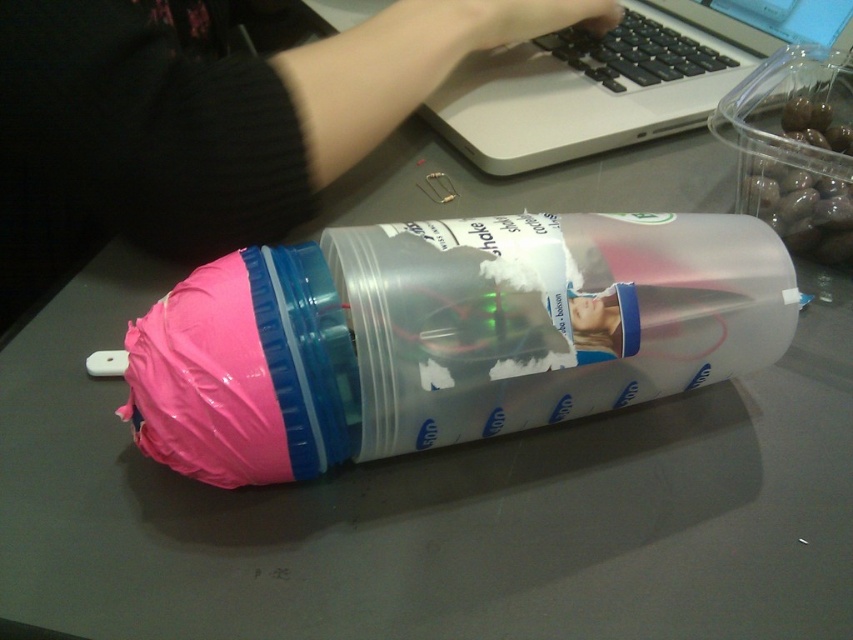
Question: Does silver metallic laptop at upper center have a smaller size compared to pink matte plastic hand at upper center?

Choices:
 (A) no
 (B) yes

Answer: (A)

Question: Which of the following is the farthest from the observer?

Choices:
 (A) tap(524, 36)
 (B) tap(691, 90)

Answer: (B)

Question: Where is silver metallic laptop at upper center located in relation to pink matte plastic hand at upper center in the image?

Choices:
 (A) right
 (B) left

Answer: (A)

Question: Which point is farther from the camera taking this photo?

Choices:
 (A) (387, 3)
 (B) (485, 49)

Answer: (A)

Question: Does silver metallic laptop at upper center have a smaller size compared to pink matte plastic hand at upper center?

Choices:
 (A) no
 (B) yes

Answer: (A)